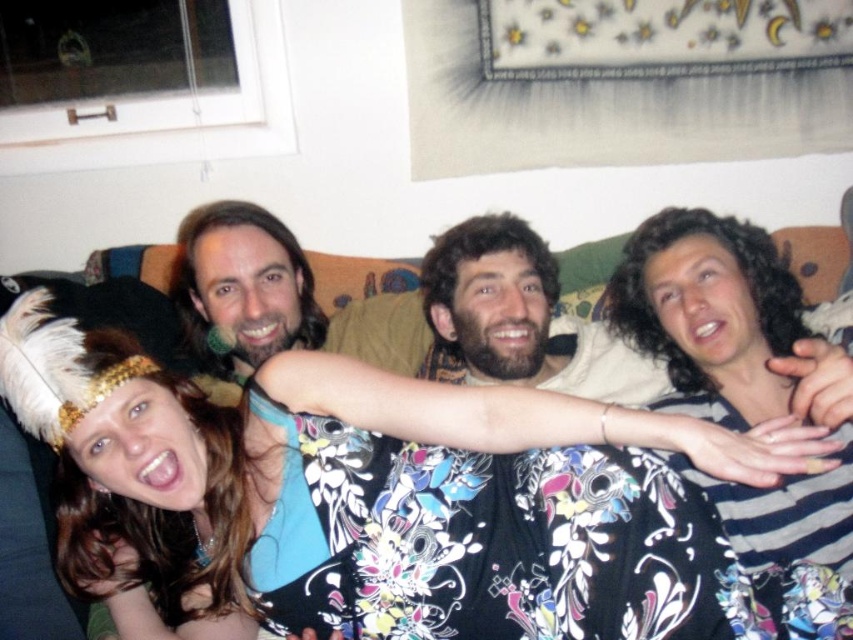
In the scene shown: Who is taller, brown curly hair at center or shiny brown hair at center?

Standing taller between the two is shiny brown hair at center.

Does brown curly hair at center have a greater height compared to shiny brown hair at center?

In fact, brown curly hair at center may be shorter than shiny brown hair at center.

Where is `brown curly hair at center`? brown curly hair at center is located at coordinates (502, 317).

In order to click on brown curly hair at center in this screenshot , I will do `click(502, 317)`.

Which of these two, striped cotton shirt at right or brown curly hair at center, stands shorter?

With less height is brown curly hair at center.

Who is more distant from viewer, (779, 310) or (569, 381)?

Positioned behind is point (569, 381).

This screenshot has height=640, width=853. What are the coordinates of `striped cotton shirt at right` in the screenshot? It's located at (717, 314).

Looking at this image, which is more to the left, floral dress at center or striped cotton shirt at right?

floral dress at center

Is floral dress at center behind striped cotton shirt at right?

No, floral dress at center is in front of striped cotton shirt at right.

At what (x,y) coordinates should I click in order to perform the action: click on floral dress at center. Please return your answer as a coordinate pair (x, y). The image size is (853, 640). Looking at the image, I should click on (386, 500).